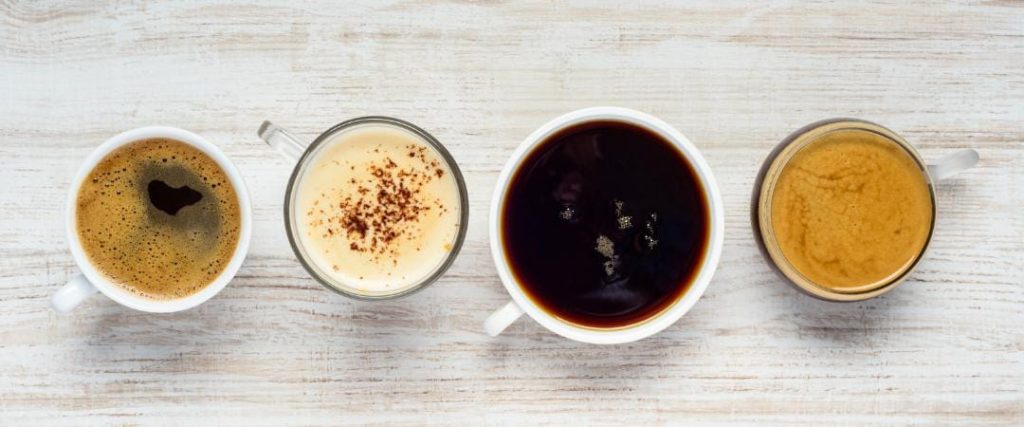
This screenshot has width=1024, height=427. I want to click on handles, so click(65, 301), click(284, 140), click(513, 313), click(963, 157).